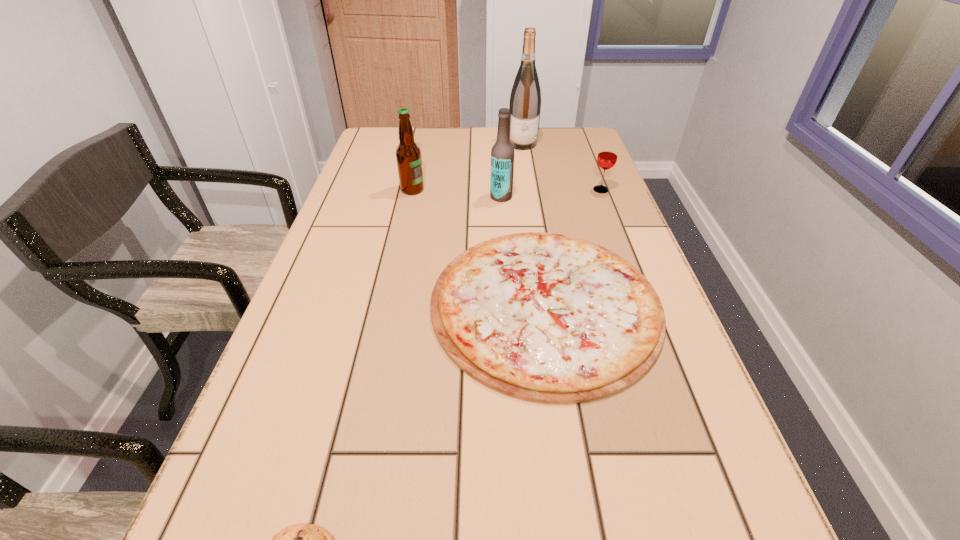
Identify the location of vacant point located 0.380m on the label of the right beer bottle. Image resolution: width=960 pixels, height=540 pixels. (353, 197).

The image size is (960, 540). I want to click on vacant space located on the label of the left beer bottle, so click(463, 190).

At what (x,y) coordinates should I click in order to perform the action: click on free space located on the front of the fourth tallest object. Please return your answer as a coordinate pair (x, y). The height and width of the screenshot is (540, 960). Looking at the image, I should click on (613, 221).

This screenshot has height=540, width=960. I want to click on vacant space located on the back of the fifth tallest object, so click(x=525, y=174).

This screenshot has width=960, height=540. In order to click on object present at the far edge in this screenshot , I will do `click(525, 101)`.

Where is `object located in the left edge section of the desktop`? This screenshot has width=960, height=540. object located in the left edge section of the desktop is located at coordinates click(x=408, y=154).

You are a GUI agent. You are given a task and a screenshot of the screen. Output one action in this format:
    pyautogui.click(x=<x>, y=<y>)
    Task: Click on the glass positioned at the right edge
    This screenshot has height=540, width=960.
    Given the screenshot: What is the action you would take?
    pyautogui.click(x=607, y=156)

The height and width of the screenshot is (540, 960). I want to click on pizza present at the right edge, so 544,317.

What are the coordinates of `vacant space at the far edge of the desktop` in the screenshot? It's located at (443, 132).

In the image, there is a desktop. At what (x,y) coordinates should I click in order to perform the action: click on free region at the left edge. Please return your answer as a coordinate pair (x, y). This screenshot has width=960, height=540. Looking at the image, I should click on tap(258, 395).